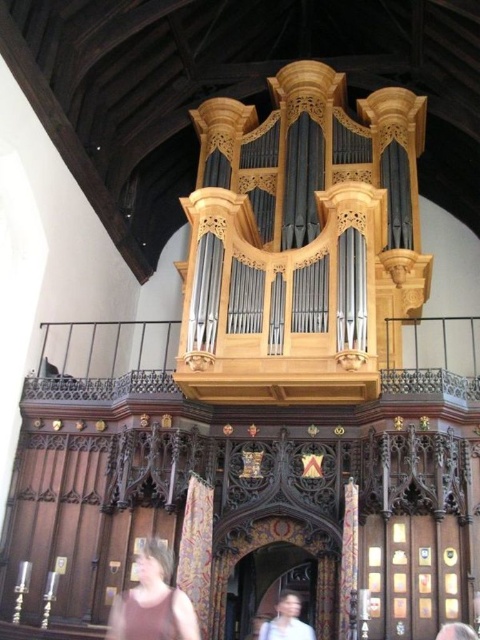
You are standing in front of the historic organ and notice a person at the lower center of the image. Which part of the person is closer to you, the brown textured shirt at lower center or the light brown hair at lower center?

The brown textured shirt at lower center is closer to the viewer than the light brown hair at lower center.

From the picture: You are a visitor standing in the historic church and see the grand organ. Your brown textured shirt at lower center is positioned at point (153, 602). If you want to take a photo of the organ without your shirt being in the frame, which direction should you move?

The brown textured shirt at lower center is at point (153, 602). To avoid it in the photo, move away from that point towards the opposite direction.

You are standing in the historic church and want to place a new coat of arms on the wooden structure below the organ. The current coat of arms is located at the brown textured shirt at lower center. Where should you place the new coat of arms to ensure it is directly above the existing one?

The new coat of arms should be placed directly above the brown textured shirt at lower center at the same x coordinate, which is 0.941, but with a lower y coordinate to move upwards since in coordinate systems, lower y values mean higher positions.